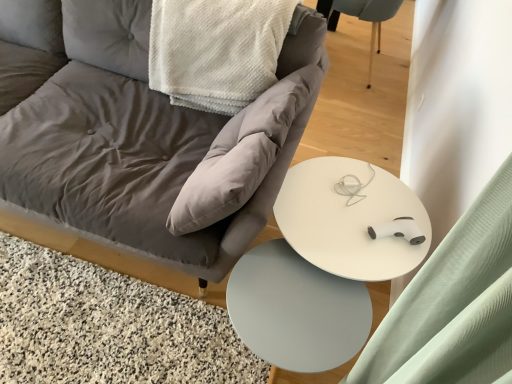
In order to face matte gray fabric chair at center, should I rotate leftwards or rightwards?

It's best to rotate left around 22.695 degrees.

Find the location of a particular element. Image resolution: width=512 pixels, height=384 pixels. white textured blanket at upper center is located at coordinates (216, 50).

Image resolution: width=512 pixels, height=384 pixels. Describe the element at coordinates (367, 18) in the screenshot. I see `light blue fabric swivel chair at upper right` at that location.

What is the approximate height of white matte table at center?

It is 16.16 inches.

The width and height of the screenshot is (512, 384). What are the coordinates of `matte gray fabric chair at center` in the screenshot? It's located at (152, 142).

Which is behind, point (271, 355) or point (260, 253)?

Point (260, 253)

Which is more to the right, white matte table at center or white glossy round table at center?

white glossy round table at center is more to the right.

Does white matte table at center come in front of white glossy round table at center?

Yes, white matte table at center is closer to the viewer.

Is white matte table at center positioned beyond the bounds of white glossy round table at center?

white matte table at center is positioned outside white glossy round table at center.

From the image's perspective, is white matte table at center below white textured blanket at upper center?

Yes.

Can you tell me how much white matte table at center and white textured blanket at upper center differ in facing direction?

3.89e-05 degrees separate the facing orientations of white matte table at center and white textured blanket at upper center.

From a real-world perspective, is white matte table at center located higher than white textured blanket at upper center?

No.

Looking at this image, is white matte table at center placed right next to white textured blanket at upper center?

No, white matte table at center is not in contact with white textured blanket at upper center.

Consider the image. Can you see matte gray fabric chair at center touching white matte table at center?

matte gray fabric chair at center and white matte table at center are clearly separated.

Is matte gray fabric chair at center in front of or behind white matte table at center in the image?

matte gray fabric chair at center is in front of white matte table at center.

Which object is positioned more to the left, matte gray fabric chair at center or white matte table at center?

Positioned to the left is matte gray fabric chair at center.

Locate an element on the screen. This screenshot has width=512, height=384. chair lying in front of the white matte table at center is located at coordinates (152, 142).

From the picture: From a real-world perspective, which is physically above, light blue fabric swivel chair at upper right or white glossy round table at center?

light blue fabric swivel chair at upper right.

Considering the points (329, 17) and (339, 217), which point is behind, point (329, 17) or point (339, 217)?

The point (329, 17) is farther from the camera.

Is light blue fabric swivel chair at upper right spatially inside white glossy round table at center, or outside of it?

light blue fabric swivel chair at upper right is not enclosed by white glossy round table at center.

Considering the positions of objects matte gray fabric chair at center and white textured blanket at upper center in the image provided, who is in front, matte gray fabric chair at center or white textured blanket at upper center?

matte gray fabric chair at center.

Is matte gray fabric chair at center facing away from white textured blanket at upper center?

Yes.

From the image's perspective, which is below, matte gray fabric chair at center or white textured blanket at upper center?

matte gray fabric chair at center appears lower in the image.

How many degrees apart are the facing directions of white matte table at center and matte gray fabric chair at center?

The angle between the facing direction of white matte table at center and the facing direction of matte gray fabric chair at center is 1.08e-05 degrees.

Which of these two, white matte table at center or matte gray fabric chair at center, is wider?

matte gray fabric chair at center is wider.

From a real-world perspective, is white matte table at center on top of matte gray fabric chair at center?

No, from a real-world perspective, white matte table at center is not over matte gray fabric chair at center

Considering the positions of objects white textured blanket at upper center and white glossy round table at center in the image provided, who is more to the right, white textured blanket at upper center or white glossy round table at center?

Positioned to the right is white glossy round table at center.

Based on the photo, is white textured blanket at upper center directly adjacent to white glossy round table at center?

No, white textured blanket at upper center is not with white glossy round table at center.

Can you confirm if white textured blanket at upper center is smaller than white glossy round table at center?

No, white textured blanket at upper center is not smaller than white glossy round table at center.

Is point (223, 91) farther from viewer compared to point (362, 207)?

That is True.

The height and width of the screenshot is (384, 512). Find the location of `table in front of the white glossy round table at center`. table in front of the white glossy round table at center is located at coordinates (296, 310).

Identify the location of table below the white textured blanket at upper center (from a real-world perspective). (296, 310).

Considering their positions, is light blue fabric swivel chair at upper right positioned closer to white glossy round table at center than matte gray fabric chair at center?

matte gray fabric chair at center is closer to white glossy round table at center.

Based on the photo, based on their spatial positions, is white textured blanket at upper center or white matte table at center further from white glossy round table at center?

white textured blanket at upper center lies further to white glossy round table at center than the other object.

Based on their spatial positions, is white glossy round table at center or light blue fabric swivel chair at upper right closer to matte gray fabric chair at center?

white glossy round table at center is positioned closer to the anchor matte gray fabric chair at center.

Estimate the real-world distances between objects in this image. Which object is further from matte gray fabric chair at center, white matte table at center or white glossy round table at center?

Based on the image, white matte table at center appears to be further to matte gray fabric chair at center.

When comparing their distances from light blue fabric swivel chair at upper right, does matte gray fabric chair at center or white glossy round table at center seem closer?

The object closer to light blue fabric swivel chair at upper right is matte gray fabric chair at center.

Based on their spatial positions, is matte gray fabric chair at center or white glossy round table at center further from white matte table at center?

matte gray fabric chair at center lies further to white matte table at center than the other object.

Looking at the image, which one is located further to white textured blanket at upper center, light blue fabric swivel chair at upper right or white matte table at center?

The object further to white textured blanket at upper center is light blue fabric swivel chair at upper right.

Estimate the real-world distances between objects in this image. Which object is closer to light blue fabric swivel chair at upper right, white matte table at center or matte gray fabric chair at center?

The object closer to light blue fabric swivel chair at upper right is matte gray fabric chair at center.

The width and height of the screenshot is (512, 384). Identify the location of round table between matte gray fabric chair at center and light blue fabric swivel chair at upper right from front to back. (324, 263).

This screenshot has height=384, width=512. Find the location of `round table between white textured blanket at upper center and white matte table at center vertically`. round table between white textured blanket at upper center and white matte table at center vertically is located at coordinates (324, 263).

The height and width of the screenshot is (384, 512). Find the location of `material between light blue fabric swivel chair at upper right and white matte table at center in the vertical direction`. material between light blue fabric swivel chair at upper right and white matte table at center in the vertical direction is located at coordinates (216, 50).

You are a GUI agent. You are given a task and a screenshot of the screen. Output one action in this format:
    pyautogui.click(x=<x>, y=<y>)
    Task: Click on the chair between white textured blanket at upper center and white matte table at center vertically
    The height and width of the screenshot is (384, 512).
    Given the screenshot: What is the action you would take?
    pyautogui.click(x=152, y=142)